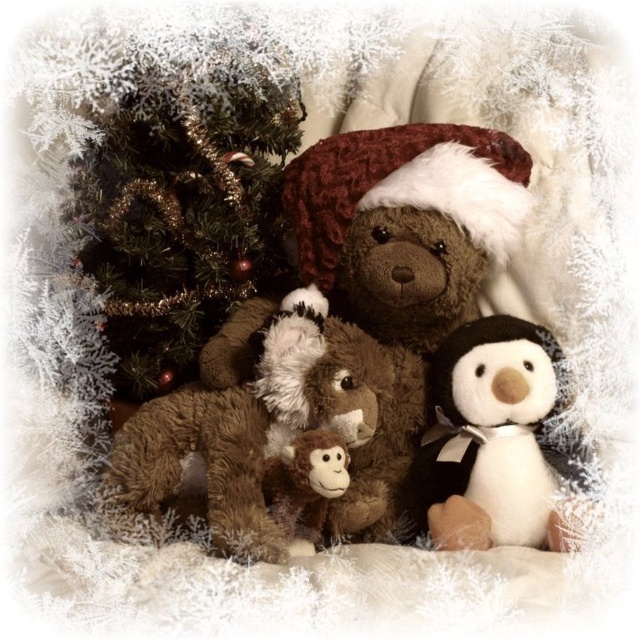
Looking at this image, you are organizing a holiday display and need to place the brown plush teddy bear at center and the fuzzy brown bear at center in a straight line. Which one should be placed to the left to maintain the original arrangement?

The brown plush teddy bear at center should be placed to the left of the fuzzy brown bear at center to maintain the original arrangement, as it was originally positioned on the left side of the fuzzy brown bear at center.

You are organizing a holiday display and need to arrange the brown plush teddy bear at center and the fuzzy brown bear at center on a shelf. Which one should you place higher up to ensure they are both visible?

The brown plush teddy bear at center is taller than the fuzzy brown bear at center, so you should place the brown plush teddy bear at center higher up to ensure both are visible.